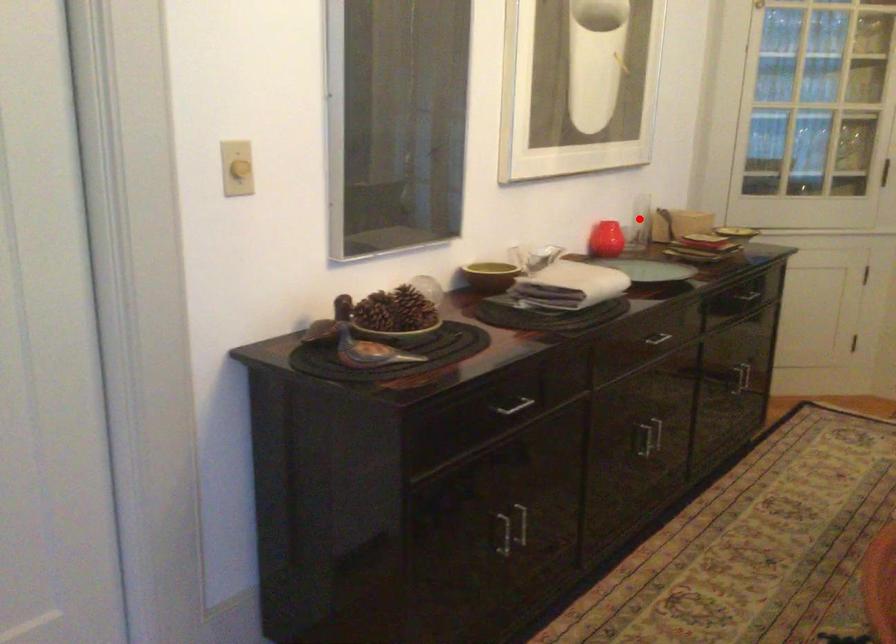
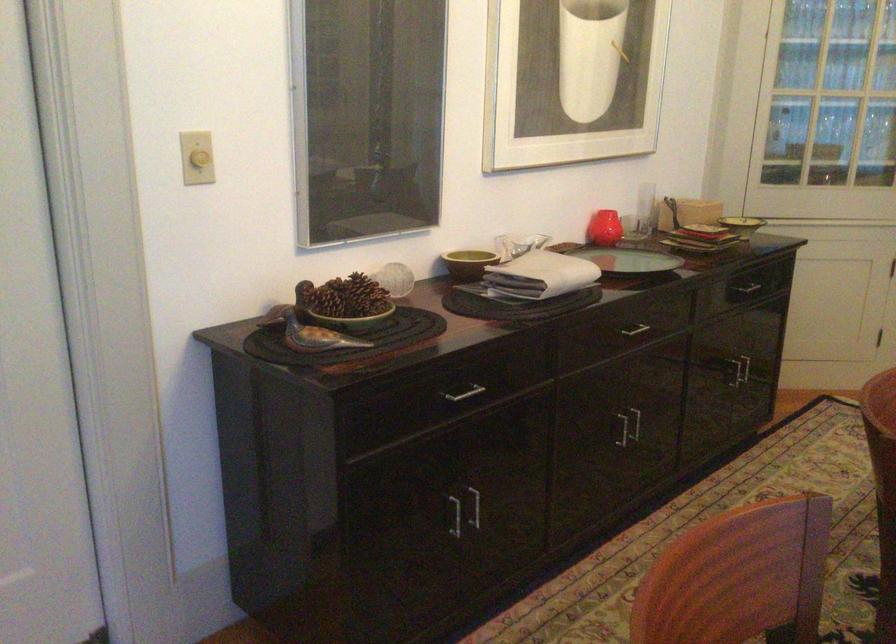
The point at the highlighted location is marked in the first image. Where is the corresponding point in the second image?

(645, 207)